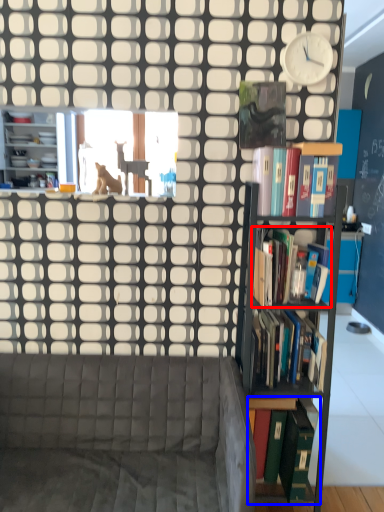
Question: Which of the following is the closest to the observer, book (highlighted by a red box) or book (highlighted by a blue box)?

Choices:
 (A) book
 (B) book

Answer: (A)